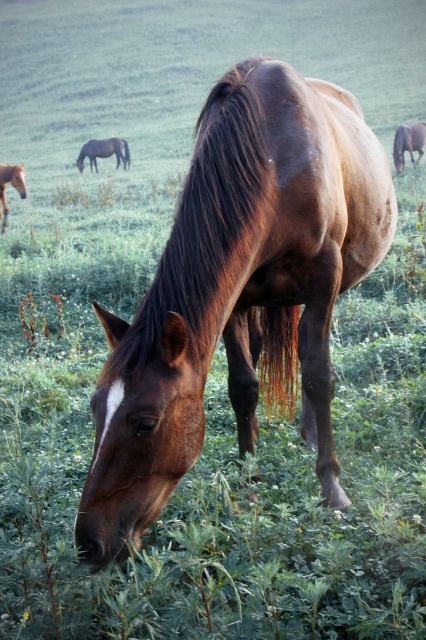
Is brown glossy horse at center wider than brown glossy horse at upper right?

Indeed, brown glossy horse at center has a greater width compared to brown glossy horse at upper right.

Find the location of `brown glossy horse at center`. brown glossy horse at center is located at coordinates (238, 289).

What do you see at coordinates (238, 289) in the screenshot? I see `brown glossy horse at center` at bounding box center [238, 289].

Identify the location of brown glossy horse at center. The image size is (426, 640). (238, 289).

Which is more to the left, brown glossy horse at upper left or brown glossy horse at left?

From the viewer's perspective, brown glossy horse at left appears more on the left side.

Between brown glossy horse at upper left and brown glossy horse at left, which one has less height?

Standing shorter between the two is brown glossy horse at left.

Is point (80, 168) closer to viewer compared to point (0, 205)?

No, it is not.

I want to click on brown glossy horse at upper left, so click(103, 150).

Is brown glossy horse at center bigger than brown glossy horse at left?

Indeed, brown glossy horse at center has a larger size compared to brown glossy horse at left.

Does brown glossy horse at center appear under brown glossy horse at left?

Indeed, brown glossy horse at center is positioned under brown glossy horse at left.

Who is more forward, (213,320) or (0,164)?

Point (213,320) is more forward.

At what (x,y) coordinates should I click in order to perform the action: click on brown glossy horse at center. Please return your answer as a coordinate pair (x, y). The height and width of the screenshot is (640, 426). Looking at the image, I should click on (238, 289).